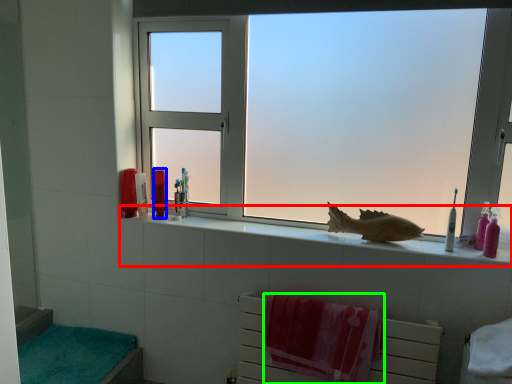
Question: Which object is the closest to the window sill (highlighted by a red box)? Choose among these: toiletry (highlighted by a blue box) or beach towel (highlighted by a green box).

Choices:
 (A) toiletry
 (B) beach towel

Answer: (B)